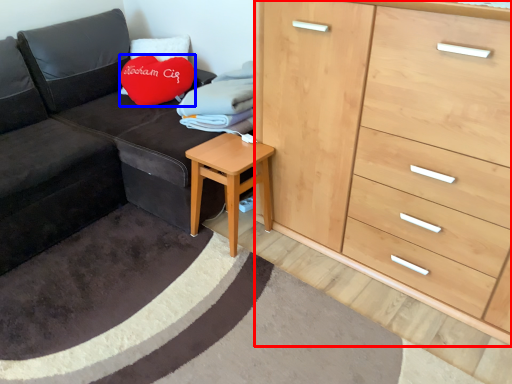
Question: Which point is closer to the camera, chest of drawers (highlighted by a red box) or throw pillow (highlighted by a blue box)?

Choices:
 (A) chest of drawers
 (B) throw pillow

Answer: (A)